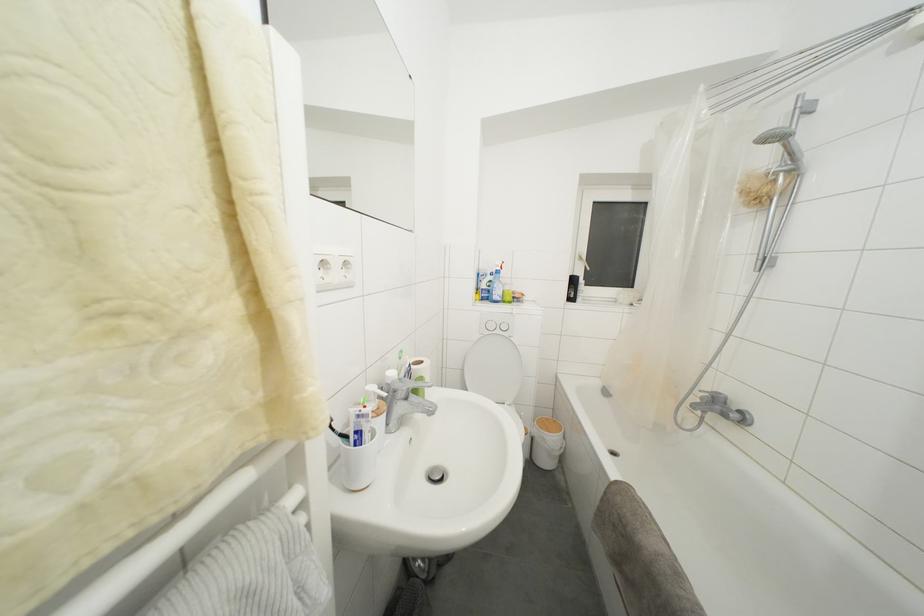
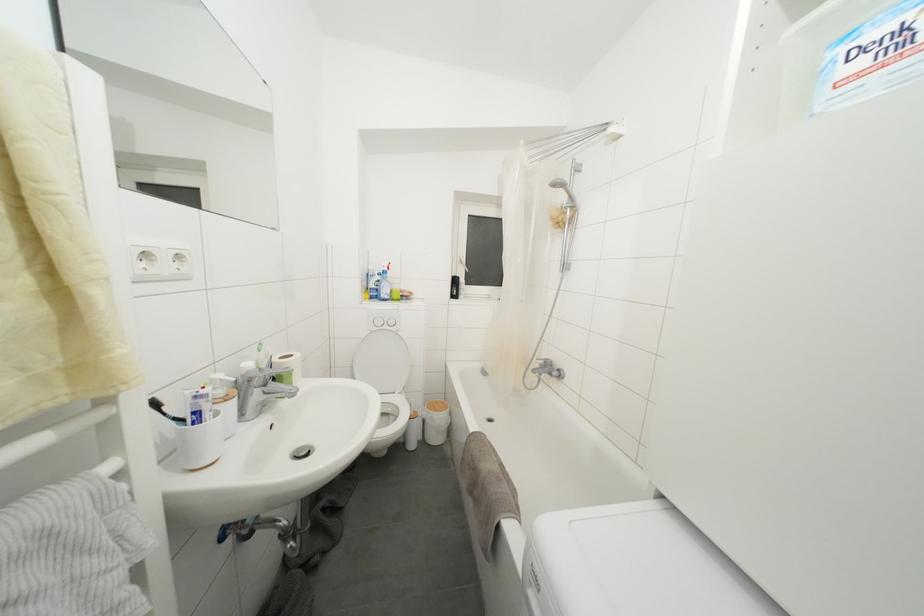
Where in the second image is the point corresponding to (x=490, y=301) from the first image?

(379, 300)